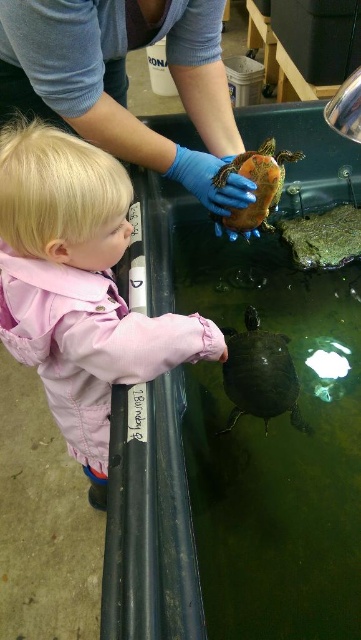
Who is positioned more to the left, shiny dark green tortoise at center or shiny orange tortoise at center?

shiny dark green tortoise at center

Describe the element at coordinates (259, 374) in the screenshot. I see `shiny dark green tortoise at center` at that location.

At what (x,y) coordinates should I click in order to perform the action: click on shiny dark green tortoise at center. Please return your answer as a coordinate pair (x, y). Looking at the image, I should click on (259, 374).

Is blue rubber glove at upper center bigger than shiny dark green tortoise at center?

Indeed, blue rubber glove at upper center has a larger size compared to shiny dark green tortoise at center.

Is blue rubber glove at upper center further to camera compared to shiny dark green tortoise at center?

No, blue rubber glove at upper center is closer to the viewer.

Identify the location of blue rubber glove at upper center. The width and height of the screenshot is (361, 640). (125, 81).

Locate an element on the screen. This screenshot has height=640, width=361. blue rubber glove at upper center is located at coordinates (125, 81).

Is blue rubber glove at upper center below shiny orange tortoise at center?

No.

Does blue rubber glove at upper center appear over shiny orange tortoise at center?

Yes.

Who is more distant from viewer, (16, 29) or (281, 186)?

Point (281, 186)

Where is `blue rubber glove at upper center`? The image size is (361, 640). blue rubber glove at upper center is located at coordinates (125, 81).